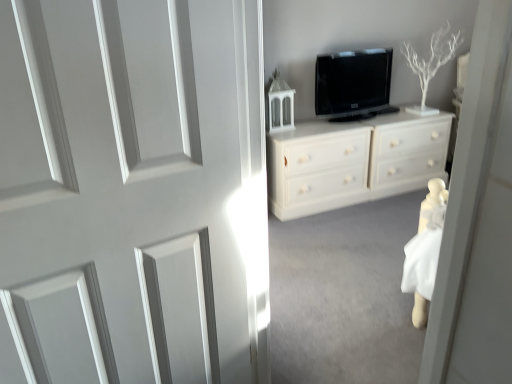
Measure the distance between white painted wood chest of drawers at center and camera.

white painted wood chest of drawers at center and camera are 2.85 meters apart from each other.

What do you see at coordinates (353, 85) in the screenshot? The image size is (512, 384). I see `black glossy tv at upper center` at bounding box center [353, 85].

What is the approximate width of white painted wood door at center?

4.07 inches.

Find the location of a particular element. This screenshot has height=384, width=512. white painted wood chest of drawers at center is located at coordinates (354, 161).

Which object is positioned more to the right, black glossy tv at upper center or white painted wood door at center?

Positioned to the right is black glossy tv at upper center.

In terms of size, does black glossy tv at upper center appear bigger or smaller than white painted wood door at center?

Clearly, black glossy tv at upper center is smaller in size than white painted wood door at center.

From a real-world perspective, is black glossy tv at upper center above or below white painted wood door at center?

Clearly, from a real-world perspective, black glossy tv at upper center is above white painted wood door at center.

Is black glossy tv at upper center not close to white painted wood door at center?

That's right, there is a large distance between black glossy tv at upper center and white painted wood door at center.

Looking at this image, what's the angular difference between white painted wood chest of drawers at center and white painted wood door at center's facing directions?

8.75 degrees.

Considering the relative sizes of white painted wood chest of drawers at center and white painted wood door at center in the image provided, is white painted wood chest of drawers at center thinner than white painted wood door at center?

Incorrect, the width of white painted wood chest of drawers at center is not less than that of white painted wood door at center.

Considering the positions of objects white painted wood chest of drawers at center and white painted wood door at center in the image provided, who is more to the left, white painted wood chest of drawers at center or white painted wood door at center?

Positioned to the left is white painted wood door at center.

Is white painted wood door at center surrounded by white painted wood chest of drawers at center?

No, white painted wood door at center is located outside of white painted wood chest of drawers at center.

Does white painted wood chest of drawers at center lie behind black glossy tv at upper center?

No, it is in front of black glossy tv at upper center.

Is point (416, 118) closer to viewer compared to point (377, 59)?

No, (416, 118) is further to viewer.

From a real-world perspective, is white painted wood chest of drawers at center below black glossy tv at upper center?

Yes, from a real-world perspective, white painted wood chest of drawers at center is beneath black glossy tv at upper center.

Which of these two, white painted wood chest of drawers at center or black glossy tv at upper center, is thinner?

Thinner between the two is black glossy tv at upper center.

Between white painted wood door at center and white painted wood chest of drawers at center, which one is positioned in front?

white painted wood door at center is more forward.

Does point (102, 44) come closer to viewer compared to point (395, 158)?

Yes, it is in front of point (395, 158).

Can you confirm if white painted wood door at center is shorter than white painted wood chest of drawers at center?

No.

Is black glossy tv at upper center at the back of white painted wood door at center?

No, white painted wood door at center is not facing away from black glossy tv at upper center.

In the scene shown: Considering the relative sizes of white painted wood door at center and black glossy tv at upper center in the image provided, is white painted wood door at center wider than black glossy tv at upper center?

Indeed, white painted wood door at center has a greater width compared to black glossy tv at upper center.

Between white painted wood door at center and black glossy tv at upper center, which one appears on the left side from the viewer's perspective?

Positioned to the left is white painted wood door at center.

Between point (54, 266) and point (387, 67), which one is positioned in front?

The point (54, 266) is closer.

Looking at their sizes, would you say black glossy tv at upper center is wider or thinner than white painted wood chest of drawers at center?

In the image, black glossy tv at upper center appears to be more narrow than white painted wood chest of drawers at center.

Relative to white painted wood chest of drawers at center, is black glossy tv at upper center in front or behind?

Visually, black glossy tv at upper center is located behind white painted wood chest of drawers at center.

Is white painted wood chest of drawers at center located within black glossy tv at upper center?

That's incorrect, white painted wood chest of drawers at center is not inside black glossy tv at upper center.

Is black glossy tv at upper center touching white painted wood chest of drawers at center?

black glossy tv at upper center is not next to white painted wood chest of drawers at center, and they're not touching.

Find the location of a particular element. This screenshot has width=512, height=384. television behind the white painted wood door at center is located at coordinates (353, 85).

Find the location of a particular element. This screenshot has width=512, height=384. chest of drawers that appears on the right of white painted wood door at center is located at coordinates (354, 161).

When comparing their distances from white painted wood chest of drawers at center, does white painted wood door at center or black glossy tv at upper center seem further?

white painted wood door at center is positioned further to the anchor white painted wood chest of drawers at center.

Estimate the real-world distances between objects in this image. Which object is further from white painted wood chest of drawers at center, black glossy tv at upper center or white painted wood door at center?

white painted wood door at center is positioned further to the anchor white painted wood chest of drawers at center.

Based on the photo, considering their positions, is white painted wood door at center positioned further to black glossy tv at upper center than white painted wood chest of drawers at center?

Based on the image, white painted wood door at center appears to be further to black glossy tv at upper center.

Based on the photo, which object lies nearer to the anchor point white painted wood door at center, black glossy tv at upper center or white painted wood chest of drawers at center?

white painted wood chest of drawers at center is closer to white painted wood door at center.

Estimate the real-world distances between objects in this image. Which object is closer to black glossy tv at upper center, white painted wood chest of drawers at center or white painted wood door at center?

white painted wood chest of drawers at center is closer to black glossy tv at upper center.

Looking at the image, which one is located closer to white painted wood door at center, white painted wood chest of drawers at center or black glossy tv at upper center?

Based on the image, white painted wood chest of drawers at center appears to be nearer to white painted wood door at center.

You are a GUI agent. You are given a task and a screenshot of the screen. Output one action in this format:
    pyautogui.click(x=<x>, y=<y>)
    Task: Click on the chest of drawers located between white painted wood door at center and black glossy tv at upper center in the depth direction
    
    Given the screenshot: What is the action you would take?
    pyautogui.click(x=354, y=161)